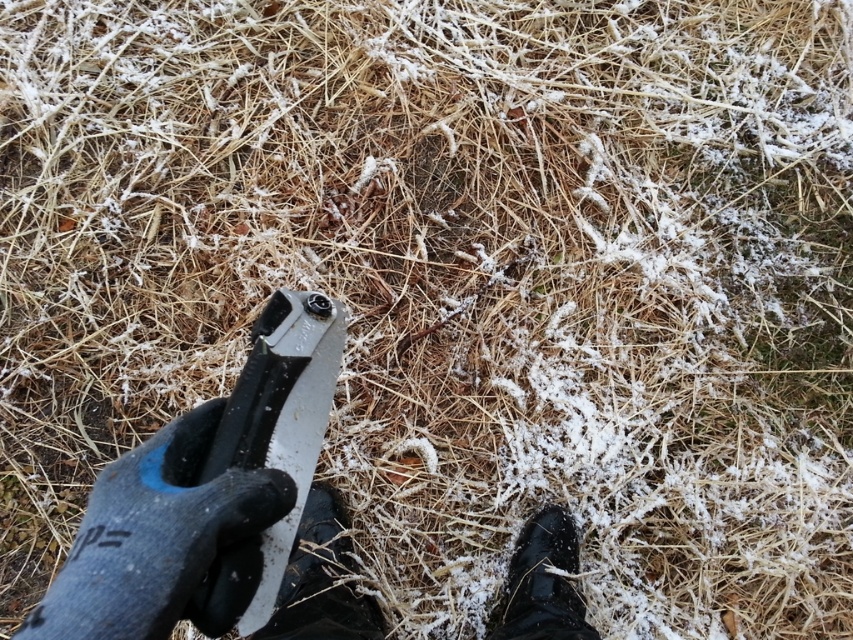
Who is positioned more to the left, metallic silver pliers at center or black rubber shoe at lower center?

Positioned to the left is black rubber shoe at lower center.

Describe the element at coordinates (273, 440) in the screenshot. I see `metallic silver pliers at center` at that location.

I want to click on metallic silver pliers at center, so click(x=273, y=440).

Does black rubber glove at lower left have a lesser width compared to black rubber shoe at lower center?

In fact, black rubber glove at lower left might be wider than black rubber shoe at lower center.

Between black rubber glove at lower left and black rubber shoe at lower center, which one is positioned higher?

Positioned higher is black rubber shoe at lower center.

Does point (167, 579) come behind point (311, 609)?

No, (167, 579) is closer to viewer.

Find the location of a particular element. The image size is (853, 640). black rubber glove at lower left is located at coordinates (161, 541).

Consider the image. Between black rubber shoe at lower center and black leather shoe at lower right, which one has less height?

With less height is black leather shoe at lower right.

Does black rubber shoe at lower center have a smaller size compared to black leather shoe at lower right?

Incorrect, black rubber shoe at lower center is not smaller in size than black leather shoe at lower right.

Which is behind, point (345, 552) or point (543, 552)?

Positioned behind is point (345, 552).

Identify the location of black rubber shoe at lower center. (321, 579).